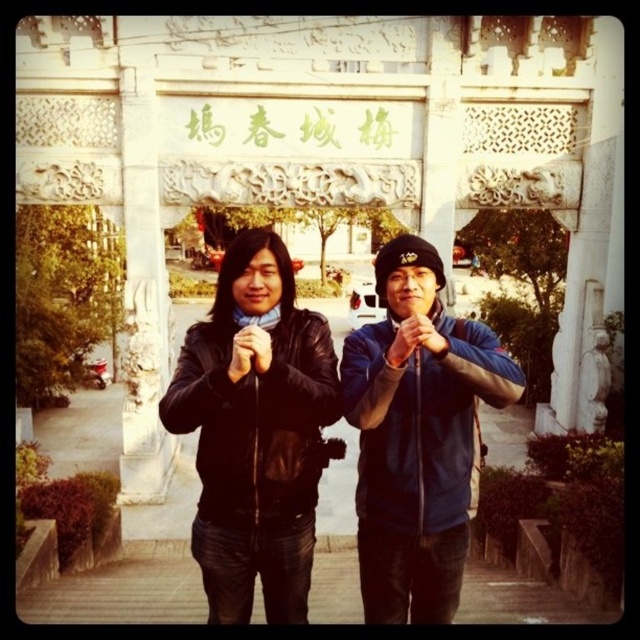
Question: Is black leather jacket at center positioned behind blue fabric jacket at center?

Choices:
 (A) yes
 (B) no

Answer: (B)

Question: Can you confirm if black leather jacket at center is thinner than blue fabric jacket at center?

Choices:
 (A) no
 (B) yes

Answer: (A)

Question: Which point is closer to the camera?

Choices:
 (A) [x=404, y=464]
 (B) [x=228, y=353]

Answer: (A)

Question: From the image, what is the correct spatial relationship of black leather jacket at center in relation to blue fabric jacket at center?

Choices:
 (A) right
 (B) left

Answer: (B)

Question: Among these objects, which one is farthest from the camera?

Choices:
 (A) blue fabric jacket at center
 (B) black leather jacket at center

Answer: (A)

Question: Which object is closer to the camera taking this photo?

Choices:
 (A) black leather jacket at center
 (B) blue fabric jacket at center

Answer: (A)